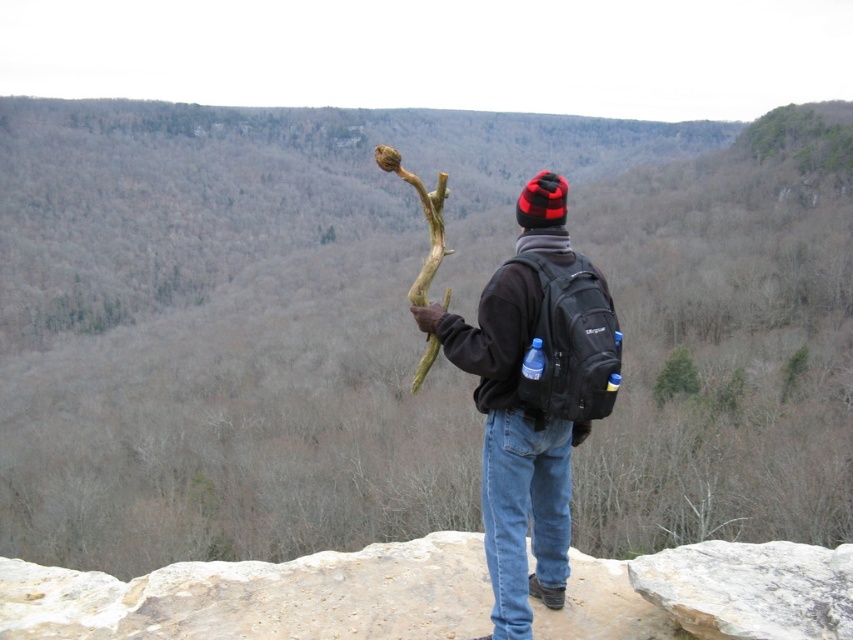
Which is behind, point (521, 538) or point (386, 148)?

Point (386, 148)

Is point (492, 428) less distant than point (415, 176)?

Yes, it is in front of point (415, 176).

Locate an element on the screen. This screenshot has width=853, height=640. black matte jacket at center is located at coordinates (532, 403).

Is point (490, 324) positioned in front of point (444, 294)?

Yes, it is in front of point (444, 294).

Is point (469, 344) closer to viewer compared to point (415, 387)?

That is True.

In order to click on black fleece jacket at center in this screenshot , I will do `click(496, 333)`.

Can you confirm if black matte jacket at center is wider than black fleece jacket at center?

Correct, the width of black matte jacket at center exceeds that of black fleece jacket at center.

Locate an element on the screen. black matte jacket at center is located at coordinates (532, 403).